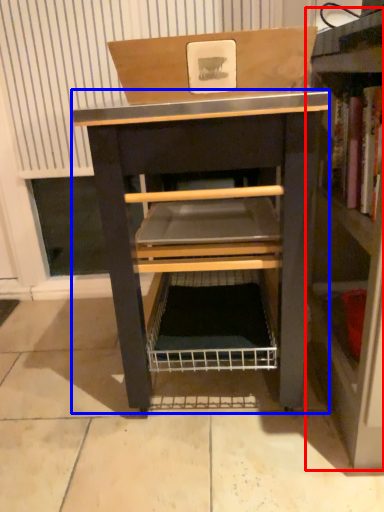
Question: Which point is closer to the camera, shelf (highlighted by a red box) or vanity (highlighted by a blue box)?

Choices:
 (A) shelf
 (B) vanity

Answer: (A)